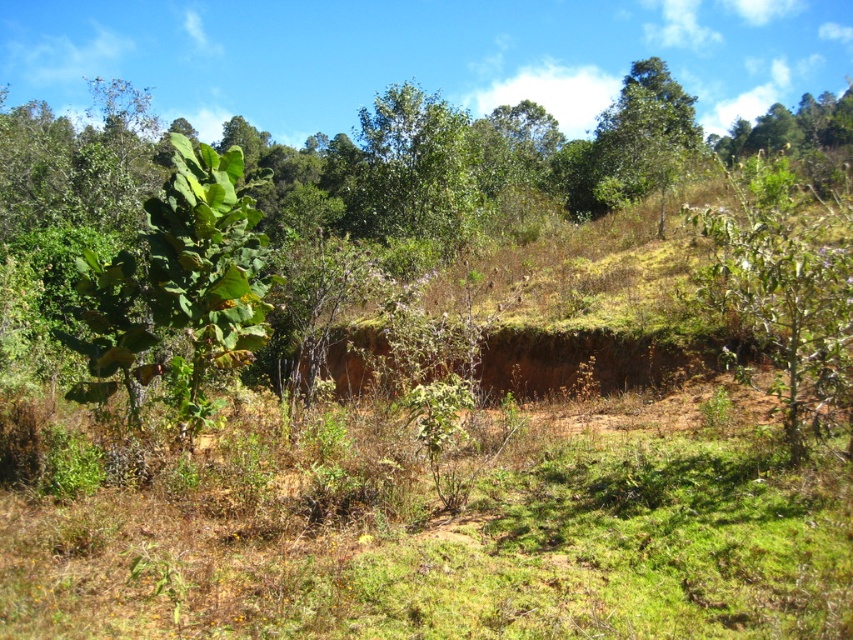
Who is positioned more to the right, green leafy tree at center or green leafy tree at upper center?

Positioned to the right is green leafy tree at upper center.

Does green leafy tree at center appear under green leafy tree at upper center?

Correct, green leafy tree at center is located below green leafy tree at upper center.

Who is more forward, (421,192) or (635,154)?

Positioned in front is point (421,192).

This screenshot has width=853, height=640. Identify the location of green leafy tree at center. (413, 170).